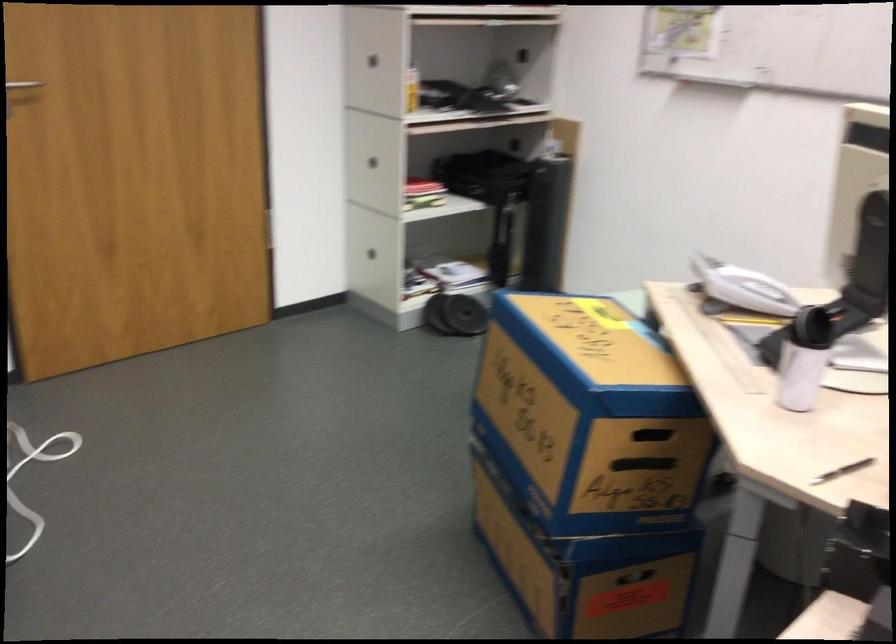
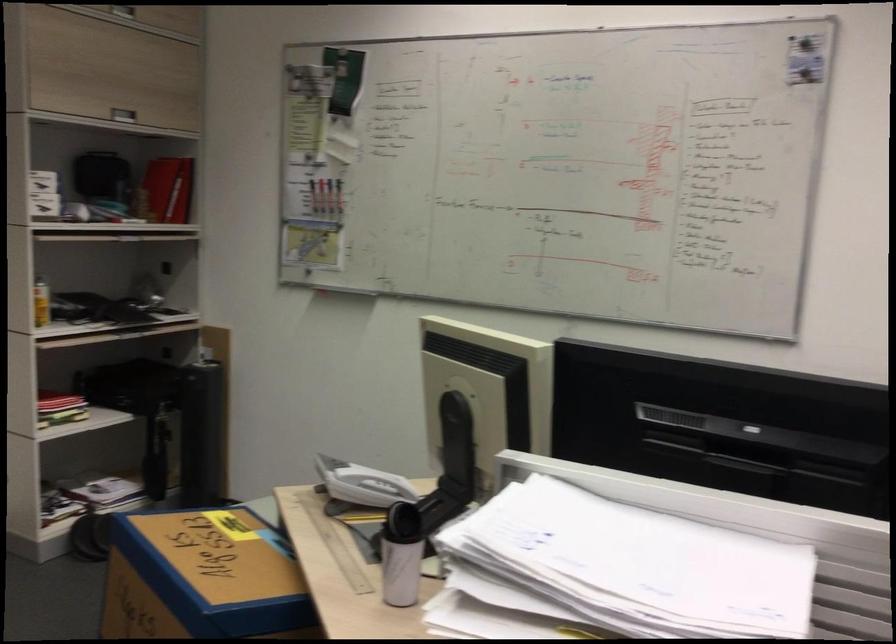
In the second image, find the point that corresponds to pixel 587 355 in the first image.

(202, 578)